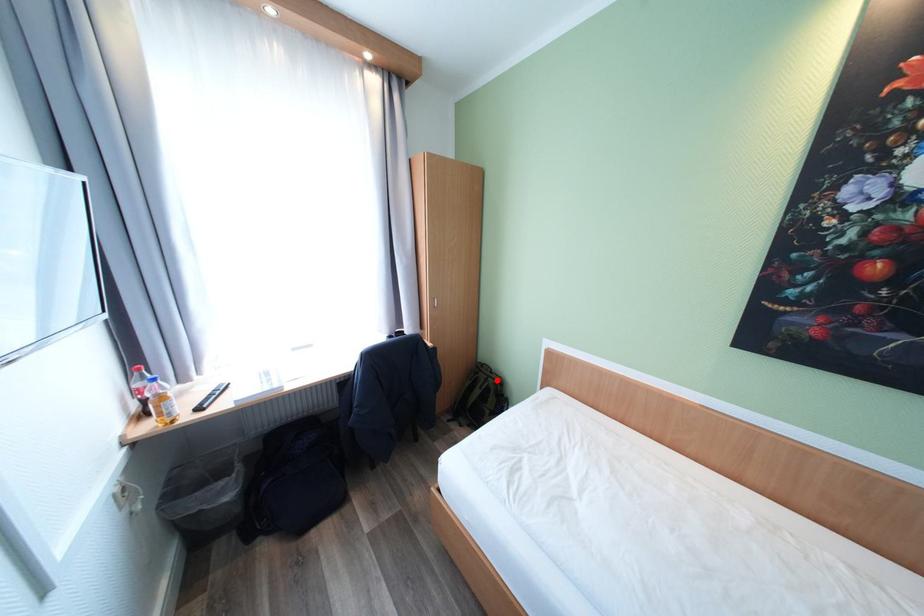
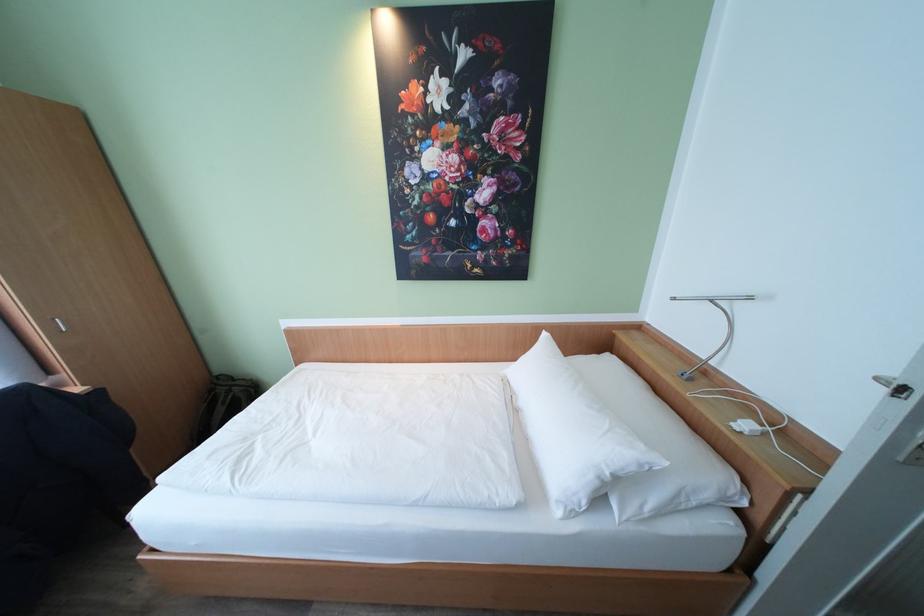
Question: A red point is marked in image1. In image2, is the corresponding 3D point closer to the camera or farther? Reply with the corresponding letter.

Choices:
 (A) The corresponding 3D point is closer.
 (B) The corresponding 3D point is farther.

Answer: (B)